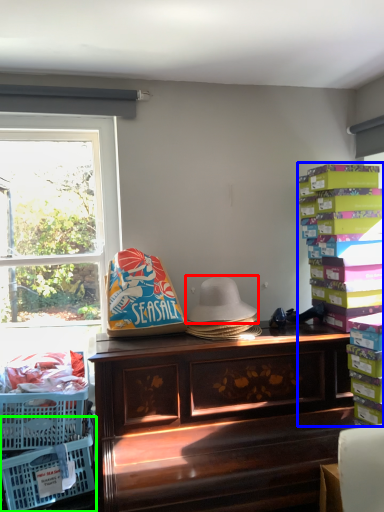
Question: Considering the real-world distances, which object is closest to hat (highlighted by a red box)? book (highlighted by a blue box) or basket (highlighted by a green box).

Choices:
 (A) book
 (B) basket

Answer: (A)